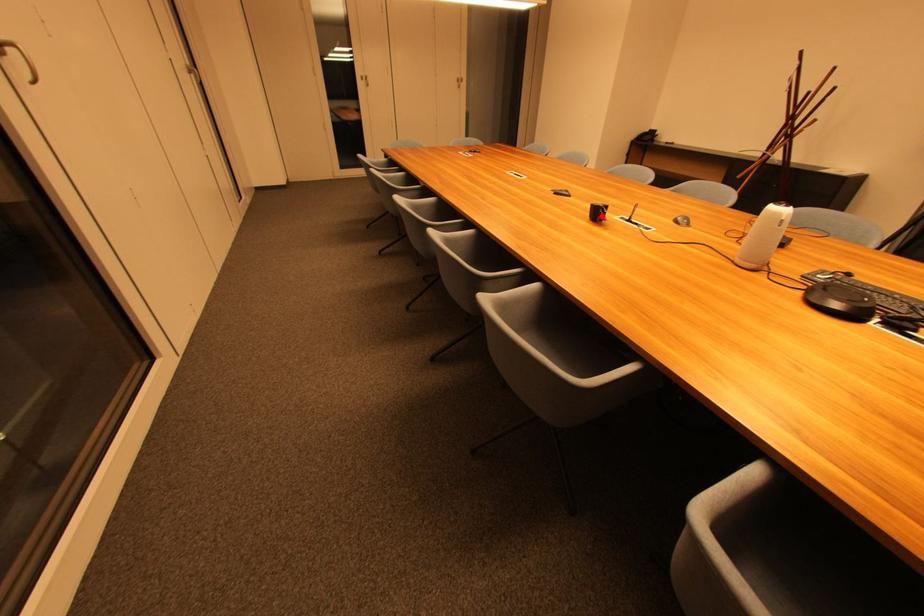
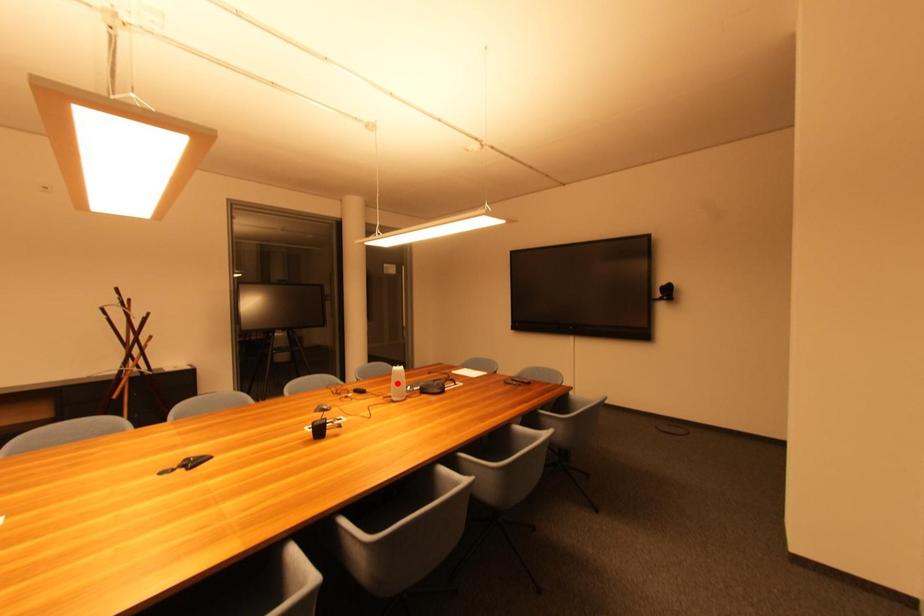
I am providing you with two images of the same scene from different viewpoints. A red point is marked on the first image and another point is marked on the second image. Is the marked point in image1 the same physical position as the marked point in image2?

No